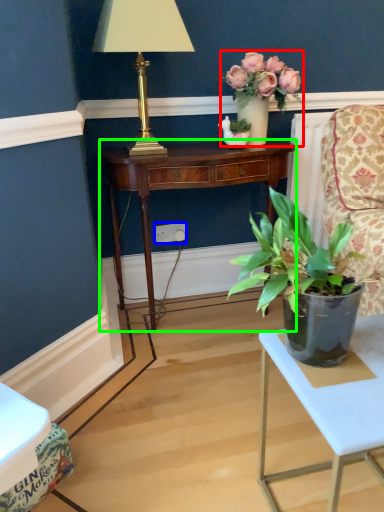
Question: Which object is positioned closest to houseplant (highlighted by a red box)? Select from power outlet (highlighted by a blue box) and desk (highlighted by a green box).

Choices:
 (A) power outlet
 (B) desk

Answer: (B)